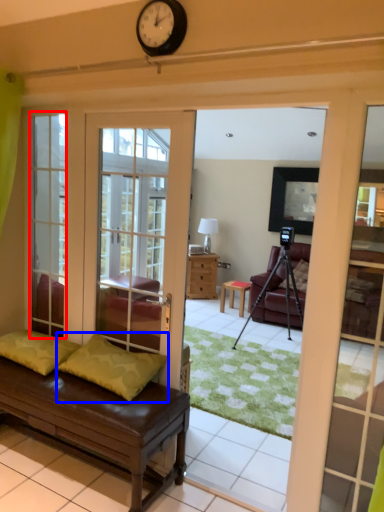
Question: Which point is further to the camera, glass door (highlighted by a red box) or pillow (highlighted by a blue box)?

Choices:
 (A) glass door
 (B) pillow

Answer: (A)